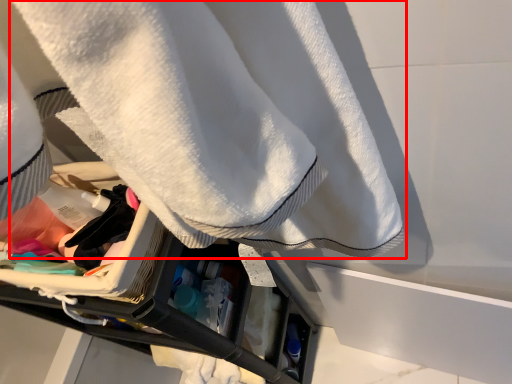
Question: Where is towel (annotated by the red box) located in relation to clothing in the image?

Choices:
 (A) right
 (B) left

Answer: (A)